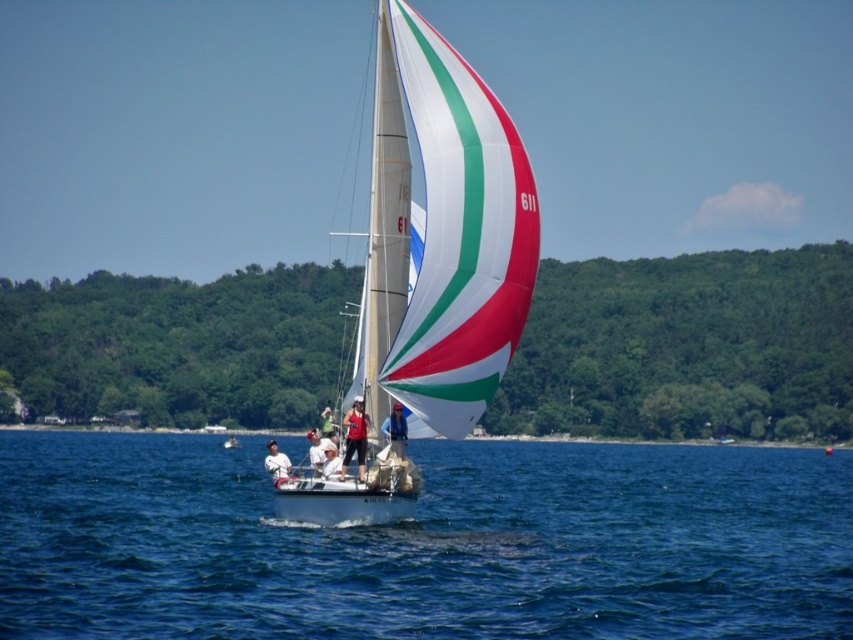
Between point (340, 460) and point (332, 420), which one is positioned behind?

The point (332, 420) is more distant.

Is point (329, 464) less distant than point (320, 428)?

Yes.

In order to click on white fabric hat at center in this screenshot , I will do `click(331, 461)`.

What do you see at coordinates (396, 429) in the screenshot? I see `blue fabric sailboat at center` at bounding box center [396, 429].

Who is shorter, blue fabric sailboat at center or matte red shirt at center?

blue fabric sailboat at center is shorter.

Is point (393, 420) more distant than point (325, 429)?

That is False.

Find the location of a particular element. This screenshot has height=640, width=853. blue fabric sailboat at center is located at coordinates (396, 429).

Is matte red tank top at center positioned behind white fabric sailboat at center?

No, matte red tank top at center is in front of white fabric sailboat at center.

The width and height of the screenshot is (853, 640). Find the location of `matte red tank top at center`. matte red tank top at center is located at coordinates (355, 436).

Does point (352, 419) come farther from viewer compared to point (268, 445)?

That is False.

The image size is (853, 640). Identify the location of matte red tank top at center. (355, 436).